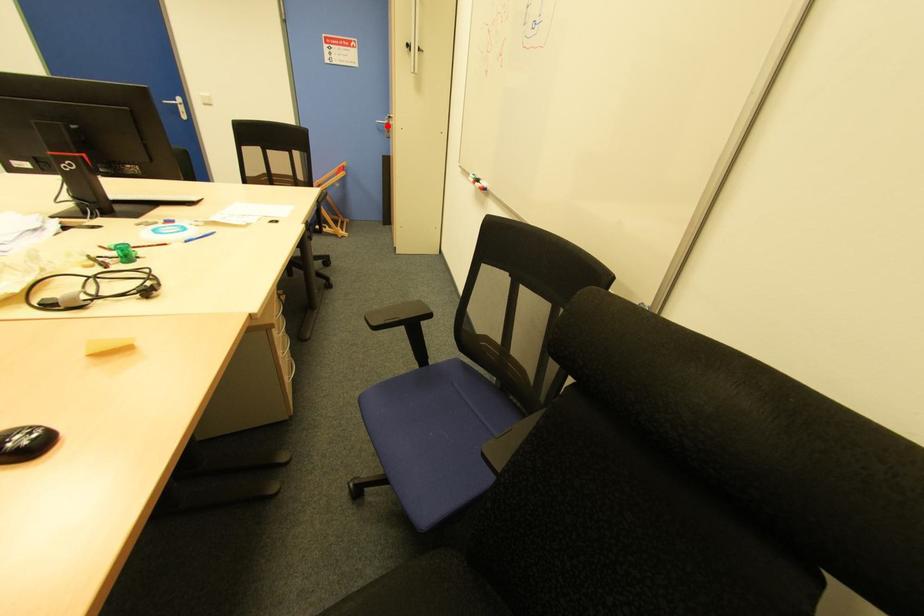
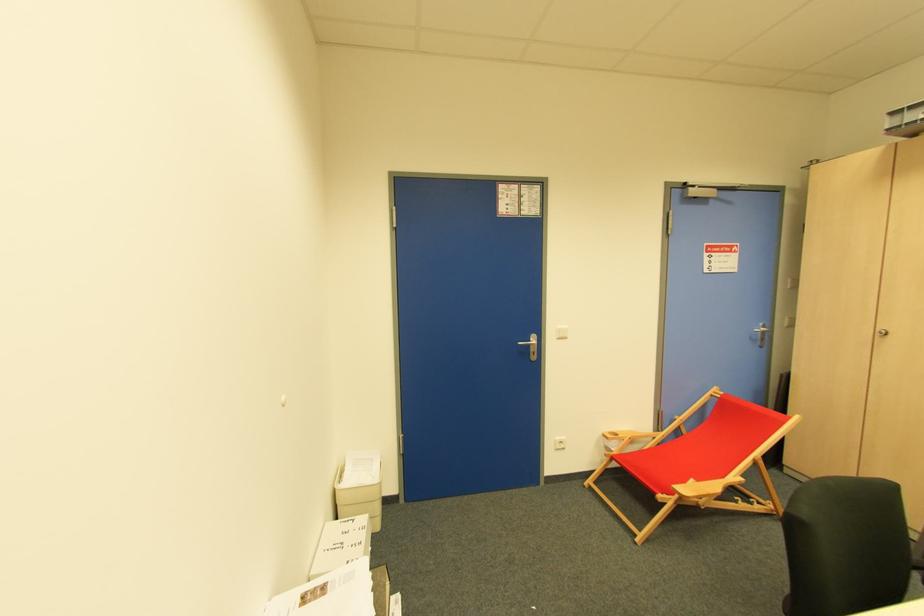
Find the pixel in the second image that matches the highlighted location in the first image.

(763, 333)